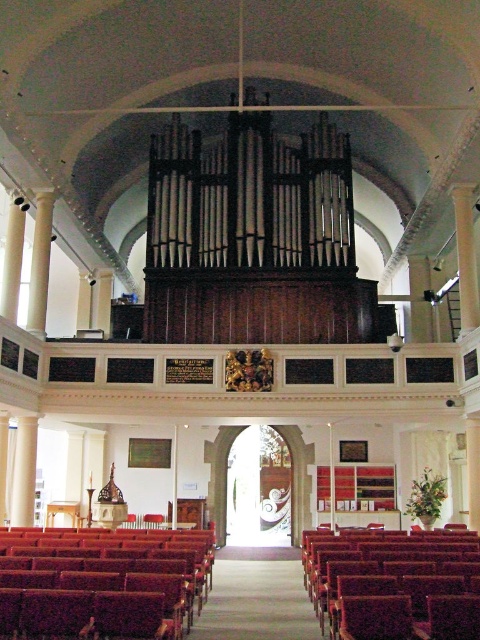
You are attending a church service and need to choose seating. You see a smooth wood bench at lower left and a velvet burgundy bench at lower right. Which bench is located to the left of the other?

The smooth wood bench at lower left is positioned on the left side of the velvet burgundy bench at lower right.

You are attending a church event and need to sit on one of the benches. The smooth wood bench at lower left and the velvet burgundy bench at lower right are both available. Which bench is closer to the front of the church?

The smooth wood bench at lower left is closer to the front of the church because it is positioned over the velvet burgundy bench at lower right, indicating it is in front.

You are a visitor to the church and want to sit comfortably during the service. You see the smooth wood bench at lower left and the velvet burgundy bench at lower right. Which bench is shorter in height?

The smooth wood bench at lower left has a lesser height compared to the velvet burgundy bench at lower right, so the smooth wood bench at lower left is shorter in height.